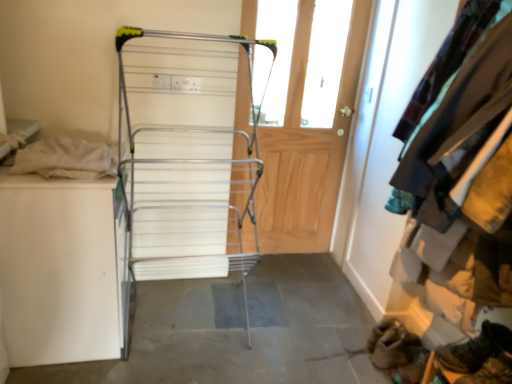
Question: Is velvet teal jacket at upper right positioned with its back to leather boot at lower right?

Choices:
 (A) no
 (B) yes

Answer: (A)

Question: Does velvet teal jacket at upper right have a smaller size compared to leather boot at lower right?

Choices:
 (A) no
 (B) yes

Answer: (A)

Question: Is velvet teal jacket at upper right not near leather boot at lower right?

Choices:
 (A) no
 (B) yes

Answer: (A)

Question: From a real-world perspective, is velvet teal jacket at upper right below leather boot at lower right?

Choices:
 (A) no
 (B) yes

Answer: (A)

Question: Considering the relative sizes of velvet teal jacket at upper right and leather boot at lower right in the image provided, is velvet teal jacket at upper right thinner than leather boot at lower right?

Choices:
 (A) yes
 (B) no

Answer: (B)

Question: From the image's perspective, is velvet teal jacket at upper right below leather boot at lower right?

Choices:
 (A) yes
 (B) no

Answer: (B)

Question: Considering the relative sizes of wooden door at center and leather boot at lower right in the image provided, is wooden door at center taller than leather boot at lower right?

Choices:
 (A) yes
 (B) no

Answer: (A)

Question: From the image's perspective, is wooden door at center under leather boot at lower right?

Choices:
 (A) yes
 (B) no

Answer: (B)

Question: Is wooden door at center oriented away from leather boot at lower right?

Choices:
 (A) yes
 (B) no

Answer: (B)

Question: Does wooden door at center have a lesser height compared to leather boot at lower right?

Choices:
 (A) yes
 (B) no

Answer: (B)

Question: Is wooden door at center not within leather boot at lower right?

Choices:
 (A) yes
 (B) no

Answer: (A)

Question: Considering the relative sizes of wooden door at center and leather boot at lower right in the image provided, is wooden door at center wider than leather boot at lower right?

Choices:
 (A) yes
 (B) no

Answer: (B)

Question: Can you confirm if silver metallic drying rack at center is bigger than wooden door at center?

Choices:
 (A) no
 (B) yes

Answer: (B)